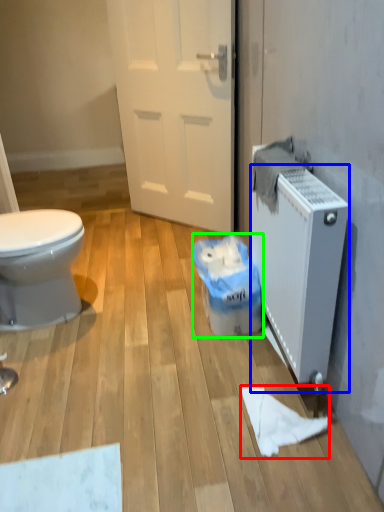
Question: Estimate the real-world distances between objects in this image. Which object is closer to toilet paper (highlighted by a red box), radiator (highlighted by a blue box) or garbage (highlighted by a green box)?

Choices:
 (A) radiator
 (B) garbage

Answer: (A)